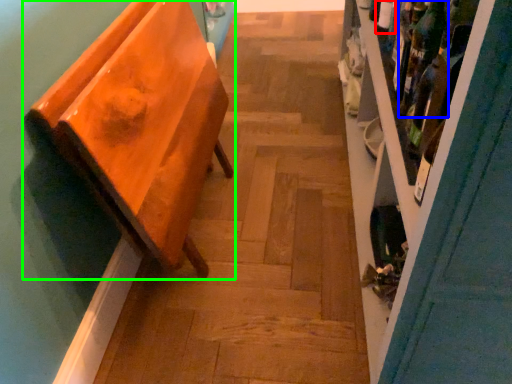
Question: Considering the real-world distances, which object is farthest from bottle (highlighted by a red box)? wine bottle (highlighted by a blue box) or furniture (highlighted by a green box)?

Choices:
 (A) wine bottle
 (B) furniture

Answer: (B)